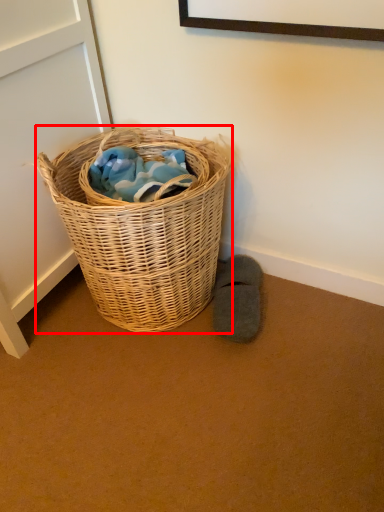
Question: Where is picnic basket (annotated by the red box) located in relation to footwear in the image?

Choices:
 (A) right
 (B) left

Answer: (B)